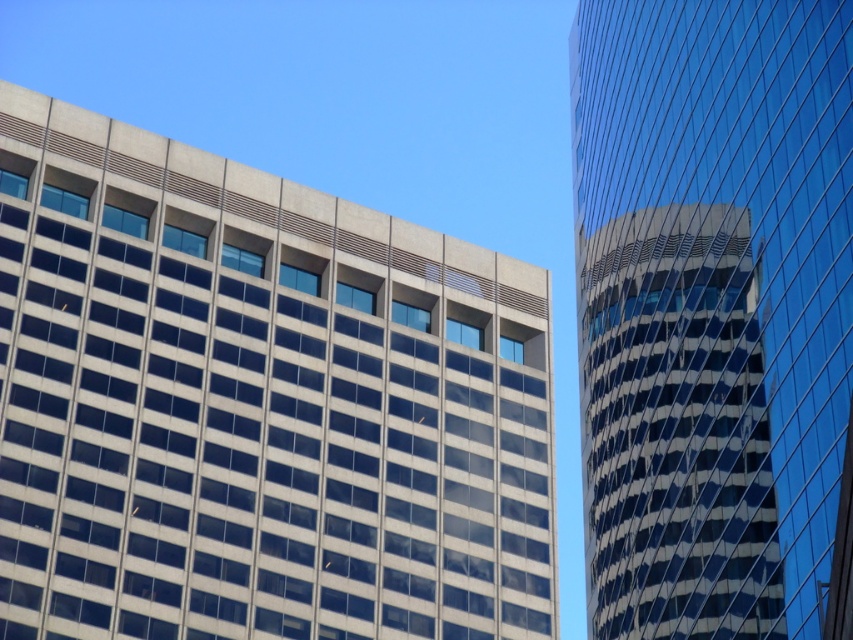
Does gray concrete building at upper left appear on the right side of glassy reflective tower at right?

In fact, gray concrete building at upper left is to the left of glassy reflective tower at right.

Is gray concrete building at upper left above glassy reflective tower at right?

Actually, gray concrete building at upper left is below glassy reflective tower at right.

Locate an element on the screen. gray concrete building at upper left is located at coordinates (256, 404).